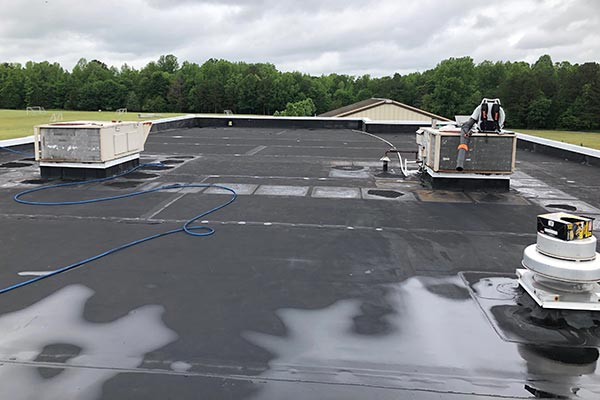
The width and height of the screenshot is (600, 400). What are the coordinates of `possibly top component of ventilation system inside buildling` in the screenshot? It's located at (101, 140).